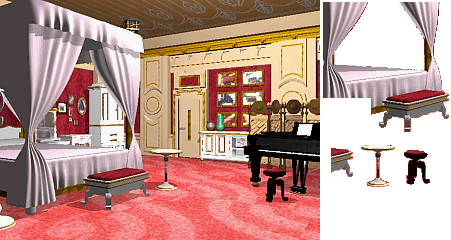
Where is `stool`? The width and height of the screenshot is (451, 240). stool is located at coordinates (115, 176).